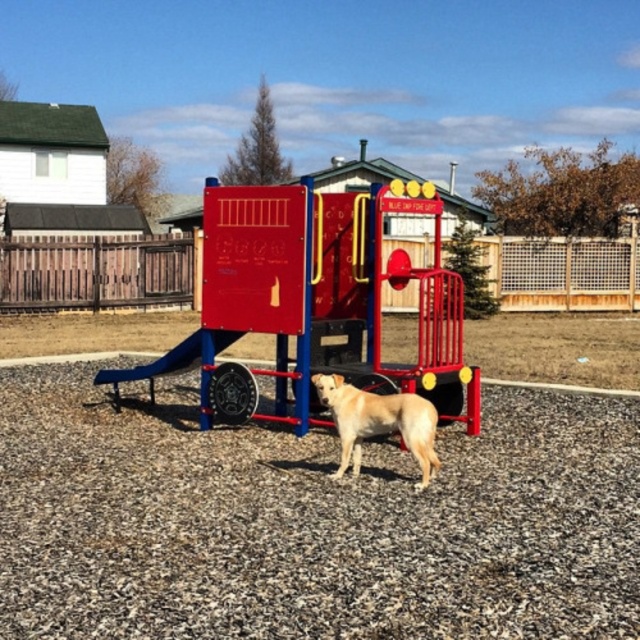
Question: Can you confirm if golden fur dog at center is bigger than metallic blue slide at center?

Choices:
 (A) no
 (B) yes

Answer: (A)

Question: From the image, what is the correct spatial relationship of golden fur dog at center in relation to metallic blue slide at center?

Choices:
 (A) left
 (B) right

Answer: (B)

Question: Does metallic red playground equipment at center come behind golden fur dog at center?

Choices:
 (A) no
 (B) yes

Answer: (B)

Question: Which object is closer to the camera taking this photo?

Choices:
 (A) metallic red playground equipment at center
 (B) metallic blue slide at center
 (C) golden fur dog at center

Answer: (C)

Question: Which point is farther to the camera?

Choices:
 (A) (236, 332)
 (B) (161, 364)

Answer: (B)

Question: Which object is positioned farthest from the metallic red playground equipment at center?

Choices:
 (A) metallic blue slide at center
 (B) golden fur dog at center

Answer: (A)